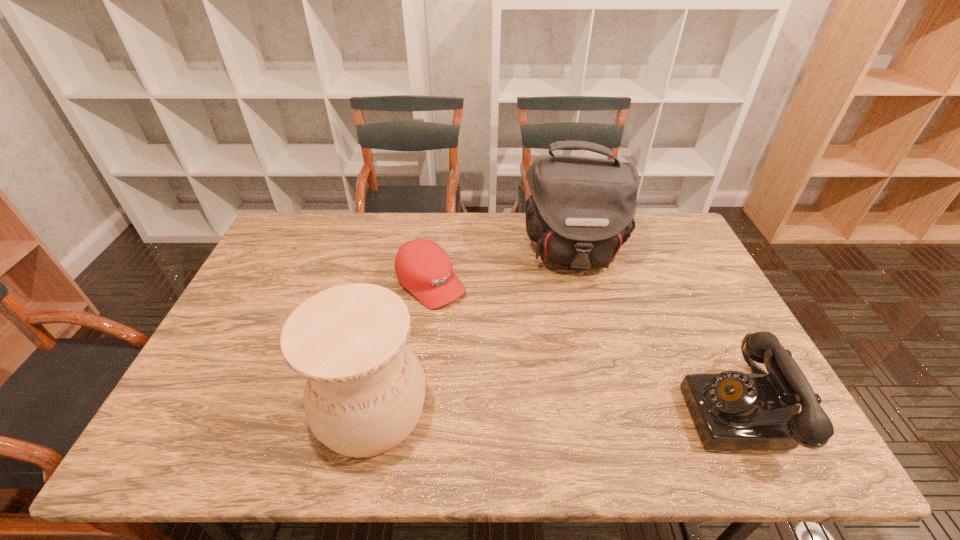
Image resolution: width=960 pixels, height=540 pixels. Find the location of `telephone located in the near edge section of the desktop`. telephone located in the near edge section of the desktop is located at coordinates (733, 410).

Where is `object present at the right edge`? The width and height of the screenshot is (960, 540). object present at the right edge is located at coordinates (733, 410).

The height and width of the screenshot is (540, 960). I want to click on object present at the near right corner, so click(733, 410).

In the image, there is a desktop. Where is `vacant region at the far edge`? The image size is (960, 540). vacant region at the far edge is located at coordinates (372, 217).

What are the coordinates of `vacant region at the near edge of the desktop` in the screenshot? It's located at (284, 389).

The width and height of the screenshot is (960, 540). Find the location of `blank area at the left edge`. blank area at the left edge is located at coordinates (292, 261).

In the image, there is a desktop. In order to click on vacant space at the far left corner in this screenshot , I will do `click(327, 222)`.

This screenshot has width=960, height=540. What are the coordinates of `free space between the third tallest object and the shoulder bag` in the screenshot? It's located at (655, 332).

You are a GUI agent. You are given a task and a screenshot of the screen. Output one action in this format:
    pyautogui.click(x=<x>, y=<y>)
    Task: Click on the vacant area that lies between the second shortest object and the shortest object
    The image size is (960, 540).
    Given the screenshot: What is the action you would take?
    pyautogui.click(x=584, y=347)

Locate an element on the screen. vacant region between the shortest object and the rightmost object is located at coordinates (584, 347).